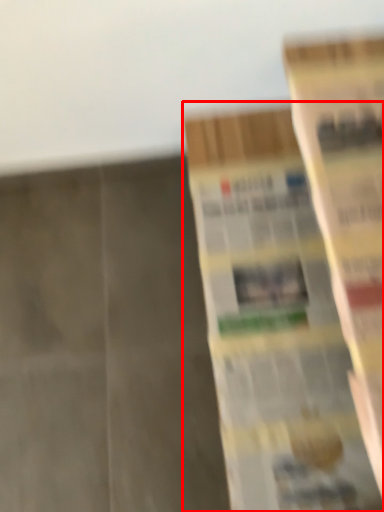
Question: Observing the image, what is the correct spatial positioning of book (annotated by the red box) in reference to book?

Choices:
 (A) left
 (B) right

Answer: (A)